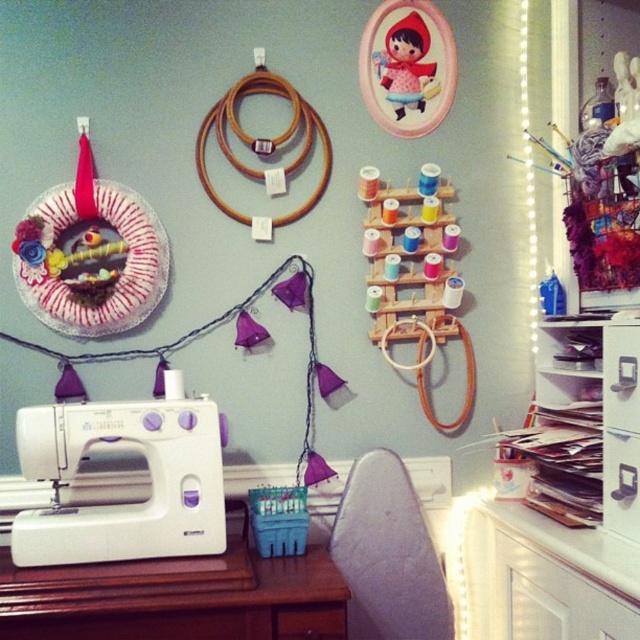
Question: Can you confirm if white plastic drawer at right is positioned to the right of matte wood drawer at lower center?

Choices:
 (A) no
 (B) yes

Answer: (B)

Question: Which of the following is the closest to the observer?

Choices:
 (A) (129, 538)
 (B) (426, 61)

Answer: (A)

Question: Which object is the closest to the matte wood drawer at lower center?

Choices:
 (A) white glossy dresser at right
 (B) white plastic drawer at right
 (C) white wood table at lower left

Answer: (C)

Question: Which point is closer to the camera?

Choices:
 (A) white wood table at lower left
 (B) matte wood drawer at lower center
 (C) matte pink fabric doll at upper center
 (D) white glossy dresser at right

Answer: (D)

Question: Can you confirm if white glossy dresser at right is positioned above matte pink fabric doll at upper center?

Choices:
 (A) yes
 (B) no

Answer: (B)

Question: Is white plastic sewing machine at lower left smaller than white plastic drawer at right?

Choices:
 (A) yes
 (B) no

Answer: (B)